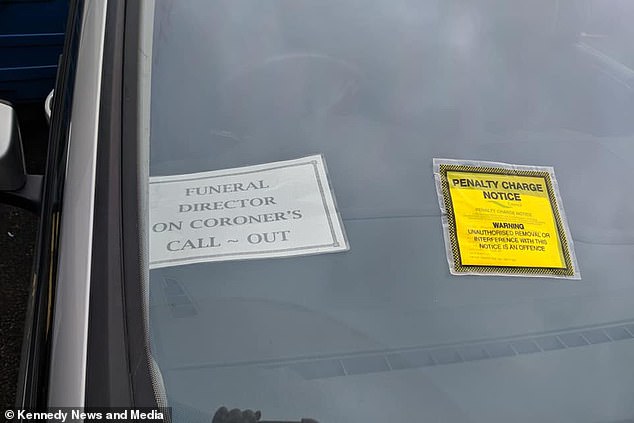
At what (x,y) coordinates should I click in order to perform the action: click on door handle. Please return your answer as a coordinate pair (x, y). This screenshot has width=634, height=423. Looking at the image, I should click on (47, 106).